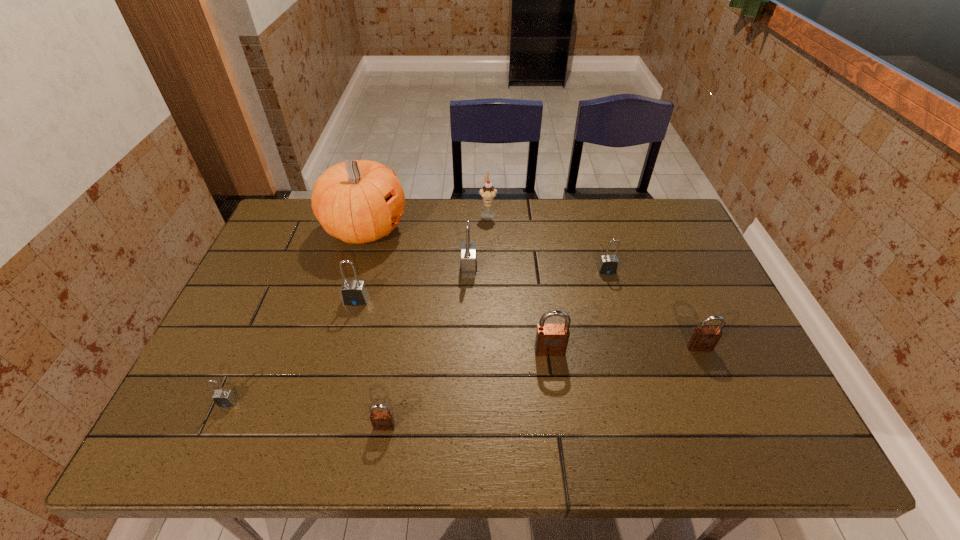
Find the location of `the second padlock from right to left`. the second padlock from right to left is located at coordinates pyautogui.click(x=608, y=264).

I want to click on the second biggest brown padlock, so click(x=703, y=338).

Identify the location of the rightmost padlock. The width and height of the screenshot is (960, 540). (703, 338).

This screenshot has width=960, height=540. Identify the location of the smallest gray padlock. (223, 398).

I want to click on the nearest gray padlock, so click(223, 398).

You are a GUI agent. You are given a task and a screenshot of the screen. Output one action in this format:
    pyautogui.click(x=<x>, y=<y>)
    Task: Click on the nearest padlock
    
    Given the screenshot: What is the action you would take?
    pyautogui.click(x=382, y=420)

I want to click on the nearest object, so coord(382,420).

Where is `free space located on the front-facing side of the pumpkin`? Image resolution: width=960 pixels, height=540 pixels. free space located on the front-facing side of the pumpkin is located at coordinates (506, 229).

Where is `vacant space located 0.260m on the shackle of the fourth padlock from left to right`? This screenshot has height=540, width=960. vacant space located 0.260m on the shackle of the fourth padlock from left to right is located at coordinates (565, 268).

Locate an element on the screen. Image resolution: width=960 pixels, height=540 pixels. vacant space located 0.180m on the right of the icecream is located at coordinates (550, 214).